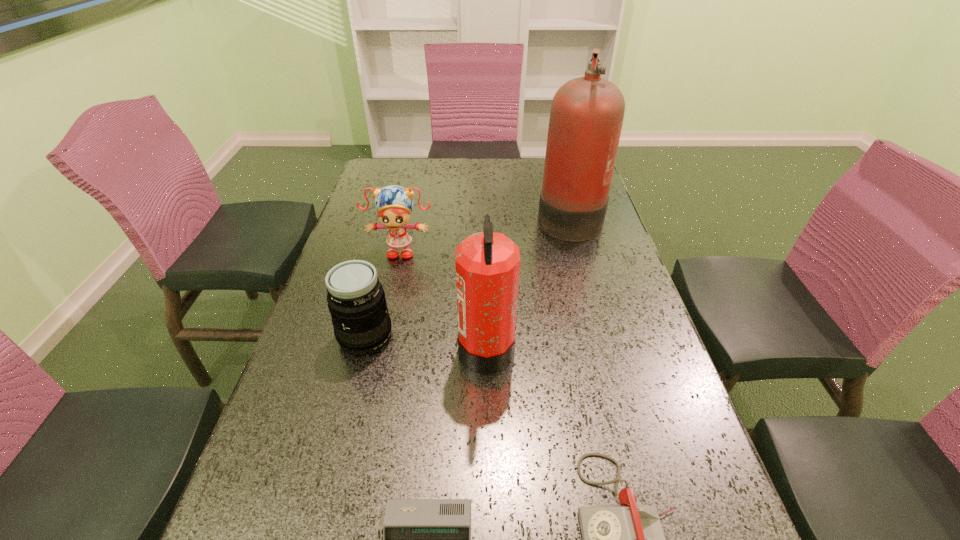
What are the coordinates of `vacant space located 0.230m on the front side of the second tallest object` in the screenshot? It's located at (357, 347).

The width and height of the screenshot is (960, 540). I want to click on free space located 0.360m on the front side of the second tallest object, so click(x=300, y=347).

The width and height of the screenshot is (960, 540). I want to click on free space located 0.080m on the face of the doll, so click(x=394, y=281).

Where is `blank space located 0.140m on the right of the telephoto lens`? The image size is (960, 540). blank space located 0.140m on the right of the telephoto lens is located at coordinates (454, 336).

Where is `doll at the left edge`? The height and width of the screenshot is (540, 960). doll at the left edge is located at coordinates (394, 204).

You are a GUI agent. You are given a task and a screenshot of the screen. Output one action in this format:
    pyautogui.click(x=<x>, y=<y>)
    Task: Click on the telephoto lens that is at the left edge
    
    Given the screenshot: What is the action you would take?
    pyautogui.click(x=356, y=300)

Identify the location of object at the right edge. 587,113.

Where is `free space at the left edge`? free space at the left edge is located at coordinates (307, 356).

Where is `free space at the right edge of the desktop`? The height and width of the screenshot is (540, 960). free space at the right edge of the desktop is located at coordinates (597, 391).

The image size is (960, 540). I want to click on object that can be found as the fourth closest to the telephoto lens, so click(626, 539).